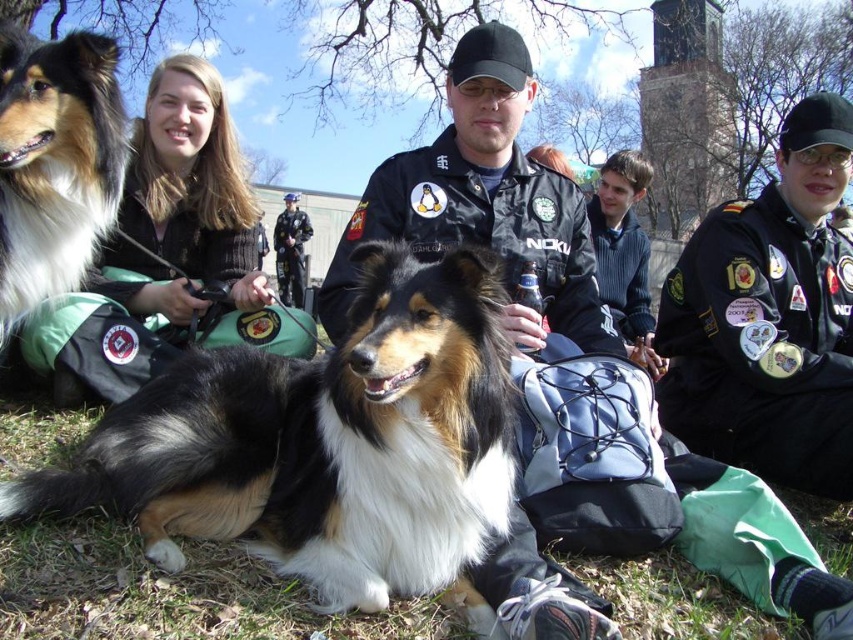
Does shaggy brown and white dog at center appear on the left side of shiny black fur at center?

Incorrect, shaggy brown and white dog at center is not on the left side of shiny black fur at center.

Looking at this image, between shaggy brown and white dog at center and shiny black fur at center, which one is positioned lower?

shaggy brown and white dog at center is below.

Is point (346, 449) less distant than point (9, 120)?

Yes, point (346, 449) is closer to viewer.

Where is `shaggy brown and white dog at center`? The height and width of the screenshot is (640, 853). shaggy brown and white dog at center is located at coordinates (323, 444).

Is point (689, 408) positioned behind point (285, 291)?

No, it is in front of (285, 291).

Between point (828, 147) and point (303, 276), which one is positioned in front?

Point (828, 147) is more forward.

Locate an element on the screen. The width and height of the screenshot is (853, 640). black uniform at center is located at coordinates (769, 317).

Is fuzzy green grass at lower center further to the viewer compared to blonde hair at center?

No.

Is fuzzy green grass at lower center bigger than blonde hair at center?

No, fuzzy green grass at lower center is not bigger than blonde hair at center.

Between point (231, 593) and point (158, 246), which one is positioned in front?

Point (231, 593) is in front.

Where is `fuzzy green grass at lower center`? fuzzy green grass at lower center is located at coordinates 169,593.